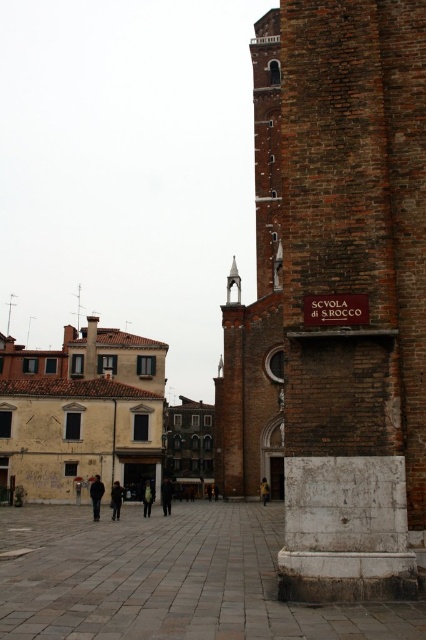
Between dark gray jacket at lower left and dark brown leather coat at center, which one is positioned lower?

dark brown leather coat at center is lower down.

Is point (97, 484) farther from camera compared to point (115, 492)?

That is False.

Is point (97, 493) positioned before point (112, 516)?

That is True.

Where is `dark gray jacket at lower left`? This screenshot has width=426, height=640. dark gray jacket at lower left is located at coordinates (95, 496).

Which is more to the left, dark gray fabric coat at center or yellow fabric at center?

Positioned to the left is dark gray fabric coat at center.

Which is in front, point (164, 502) or point (267, 492)?

Point (164, 502) is more forward.

Where is `dark gray fabric coat at center`? dark gray fabric coat at center is located at coordinates (166, 496).

Does brown brick bell tower at upper right appear over green fabric jacket at center?

Indeed, brown brick bell tower at upper right is positioned over green fabric jacket at center.

Is brown brick bell tower at upper right to the right of green fabric jacket at center from the viewer's perspective?

Correct, you'll find brown brick bell tower at upper right to the right of green fabric jacket at center.

Between point (256, 96) and point (146, 490), which one is positioned in front?

Positioned in front is point (146, 490).

In order to click on brown brick bell tower at upper right in this screenshot , I will do `click(267, 148)`.